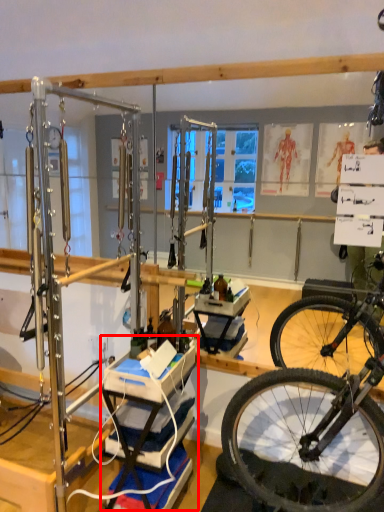
Question: From the image's perspective, what is the correct spatial relationship of workbench (annotated by the red box) in relation to yoga mat?

Choices:
 (A) above
 (B) below

Answer: (A)